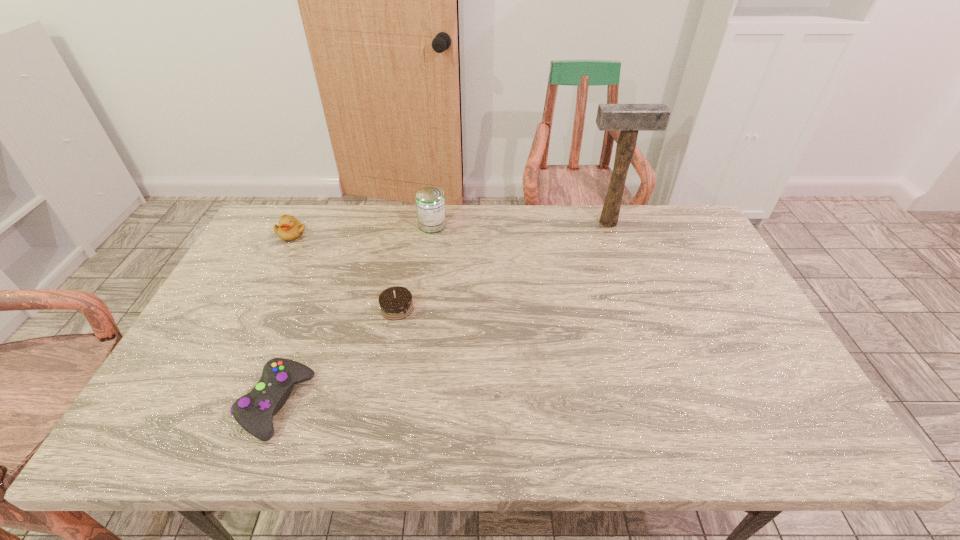
In the image, there is a desktop. At what (x,y) coordinates should I click in order to perform the action: click on free space at the left edge. Please return your answer as a coordinate pair (x, y). This screenshot has width=960, height=540. Looking at the image, I should click on (255, 310).

I want to click on free region at the right edge of the desktop, so [753, 342].

At what (x,y) coordinates should I click in order to perform the action: click on vacant point at the far left corner. Please return your answer as a coordinate pair (x, y). The width and height of the screenshot is (960, 540). Looking at the image, I should click on (261, 230).

This screenshot has height=540, width=960. Identify the location of blank region between the can and the second object from left to right. (354, 315).

Identify the location of free space between the control and the can. (354, 315).

Where is `empty space that is in between the mallet and the duckling`? This screenshot has height=540, width=960. empty space that is in between the mallet and the duckling is located at coordinates (450, 228).

I want to click on vacant space that is in between the second object from left to right and the can, so click(x=354, y=315).

At what (x,y) coordinates should I click in order to perform the action: click on vacant area that lies between the leftmost object and the tallest object. Please return your answer as a coordinate pair (x, y). The image size is (960, 540). Looking at the image, I should click on (450, 228).

Locate an element on the screen. free point between the can and the chocolate cake is located at coordinates (415, 267).

This screenshot has height=540, width=960. In order to click on free space between the duckling and the mallet in this screenshot , I will do `click(450, 228)`.